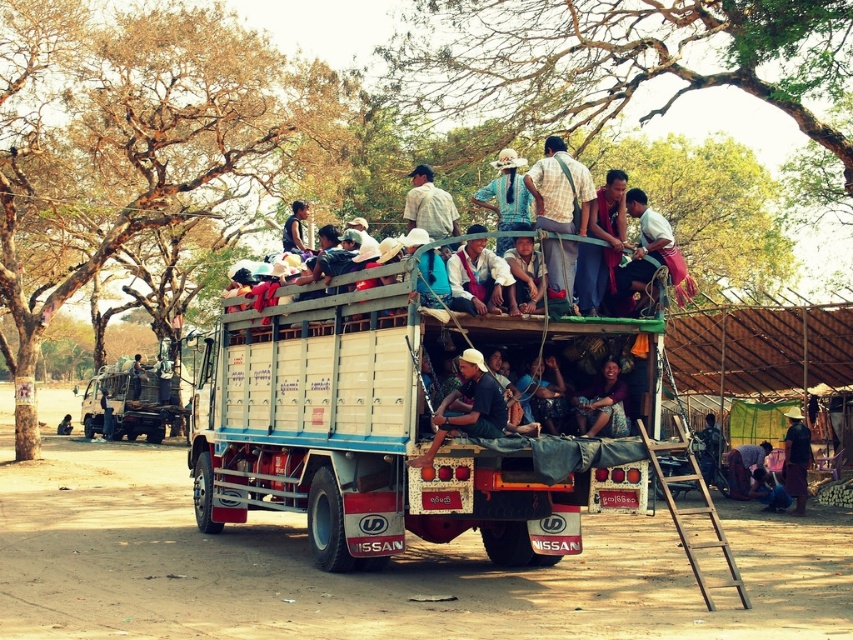
Question: Does matte purple shirt at center appear on the right side of dark blue shirt at center?

Choices:
 (A) yes
 (B) no

Answer: (A)

Question: Which point appears closest to the camera in this image?

Choices:
 (A) (532, 289)
 (B) (730, 580)
 (C) (486, 209)
 (D) (608, 394)

Answer: (B)

Question: Observing the image, what is the correct spatial positioning of checkered fabric shirt at center in reference to blue fabric shirt at center?

Choices:
 (A) above
 (B) below

Answer: (B)

Question: Does blue fabric shirt at center appear over dark blue shirt at center?

Choices:
 (A) yes
 (B) no

Answer: (A)

Question: Which object is the closest to the blue fabric shirt at center?

Choices:
 (A) matte blue shirt at center
 (B) checkered fabric shirt at center
 (C) matte purple shirt at center
 (D) wooden at right

Answer: (C)

Question: Which of the following is the closest to the observer?

Choices:
 (A) checkered fabric shirt at center
 (B) dark blue shirt at center
 (C) wooden at right

Answer: (C)